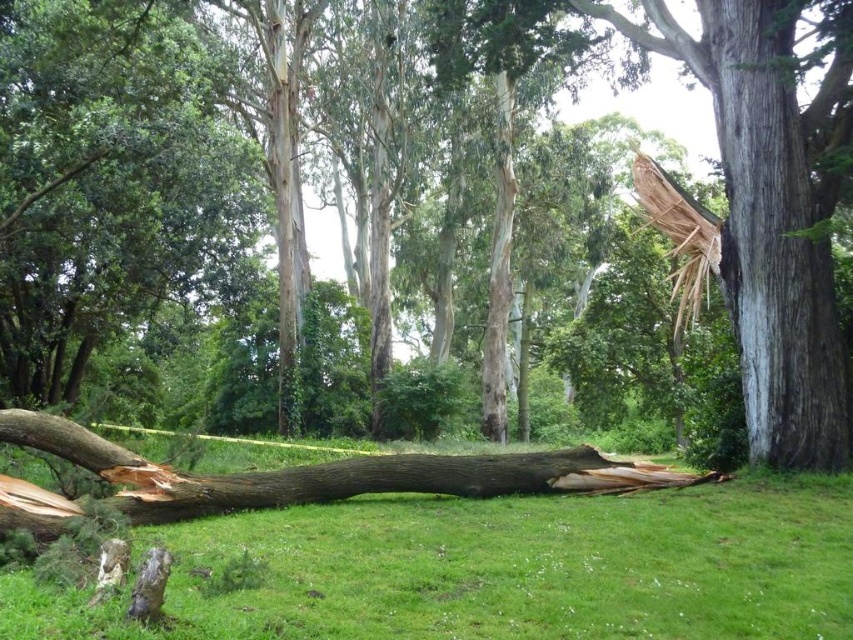
Can you confirm if green grass at center is positioned above gray rough bark tree at right?

Incorrect, green grass at center is not positioned above gray rough bark tree at right.

Which is above, green grass at center or gray rough bark tree at right?

Positioned higher is gray rough bark tree at right.

Identify the location of green grass at center. (498, 570).

The image size is (853, 640). Identify the location of green grass at center. (498, 570).

Can you confirm if brown rough wood at center is bigger than gray rough bark tree at right?

No, brown rough wood at center is not bigger than gray rough bark tree at right.

Does brown rough wood at center have a greater height compared to gray rough bark tree at right?

Incorrect, brown rough wood at center's height is not larger of gray rough bark tree at right's.

Is point (837, 461) behind point (776, 118)?

No, it is in front of (776, 118).

I want to click on brown rough wood at center, so click(x=756, y=198).

Does green grass at center come in front of brown rough tree trunk at center?

No, it is behind brown rough tree trunk at center.

Which is behind, point (769, 493) or point (585, 445)?

Positioned behind is point (585, 445).

This screenshot has width=853, height=640. Find the location of `green grass at center`. green grass at center is located at coordinates (498, 570).